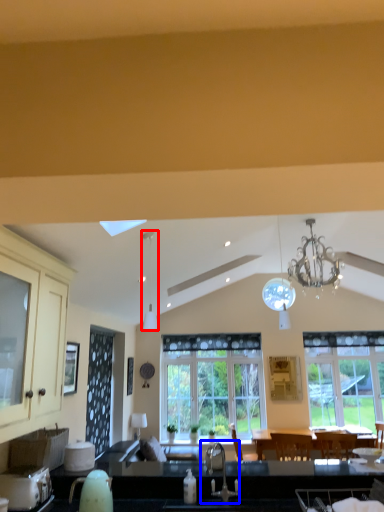
Question: Which point is closer to the camera, light fixture (highlighted by a red box) or sink (highlighted by a blue box)?

Choices:
 (A) light fixture
 (B) sink

Answer: (B)